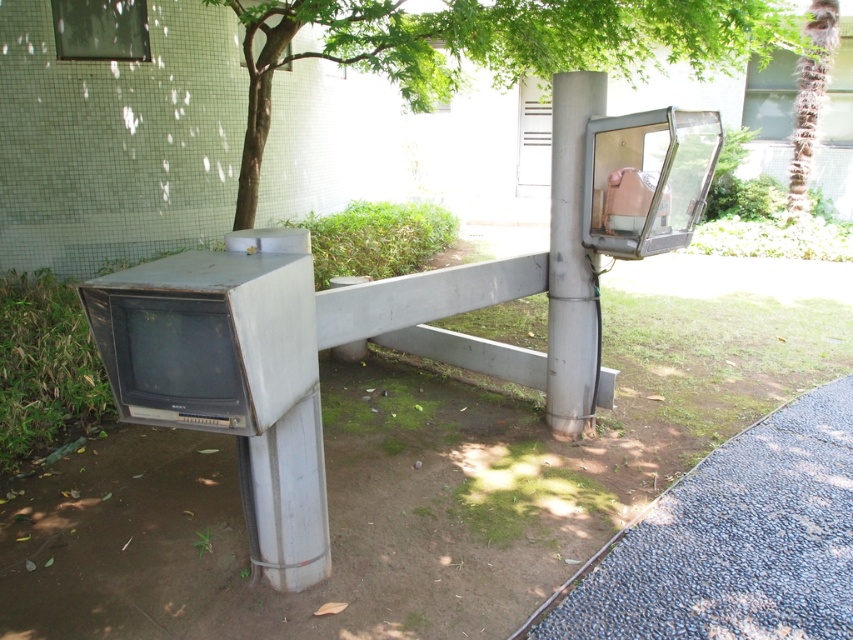
You are standing in the outdoor area shown in the image. You need to place a small potted plant between the gray gravel at lower right and the metallic gray pole at upper center. Based on their positions, where should you place the plant to ensure it is between them?

The gray gravel at lower right is below the metallic gray pole at upper center, so placing the plant between them would require positioning it above the gray gravel at lower right and below the metallic gray pole at upper center.